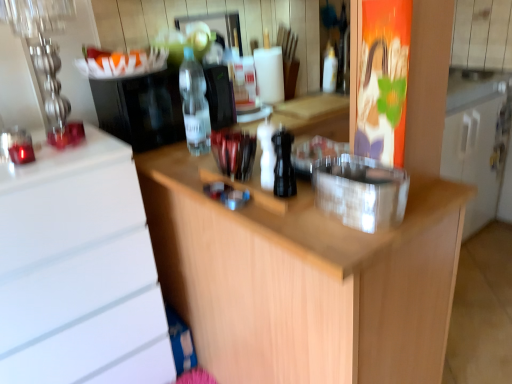
I want to click on vacant space situated on the left part of transparent plastic bottle at center, positioned as the third bottle in right-to-left order, so (162, 155).